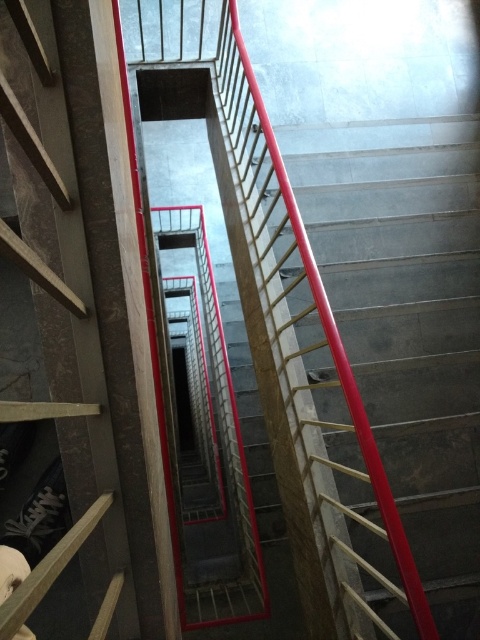
Which is in front, point (86, 573) or point (331, 355)?

Positioned in front is point (86, 573).

Can you confirm if metallic silver ladder at center is bigger than metallic red handrail at center?

Incorrect, metallic silver ladder at center is not larger than metallic red handrail at center.

The height and width of the screenshot is (640, 480). In order to click on metallic silver ladder at center in this screenshot , I will do `click(60, 317)`.

Find the location of `metallic silver ladder at center`. metallic silver ladder at center is located at coordinates (60, 317).